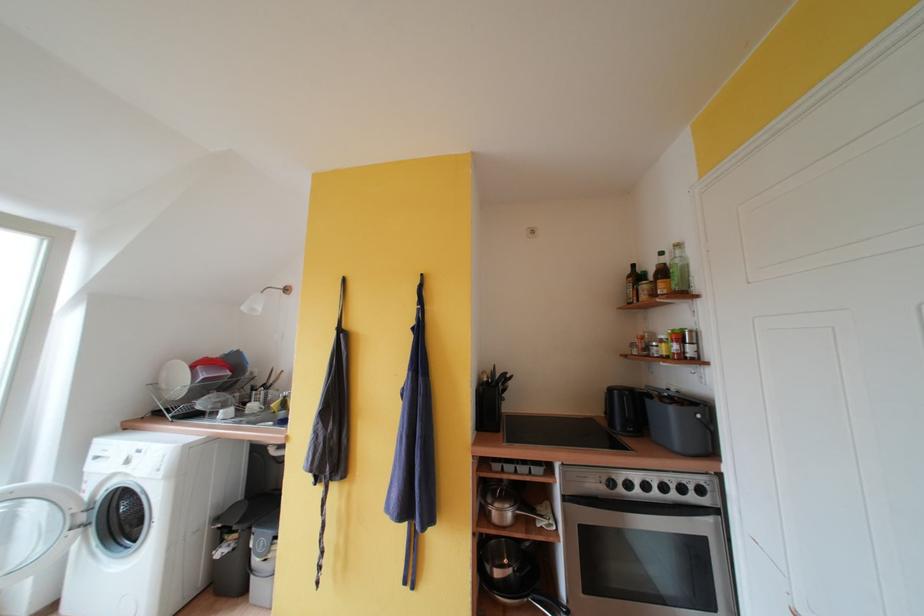
Find where to grasp the black pan handle. Please return your answer as a coordinate pair (x, y).

(546, 604)